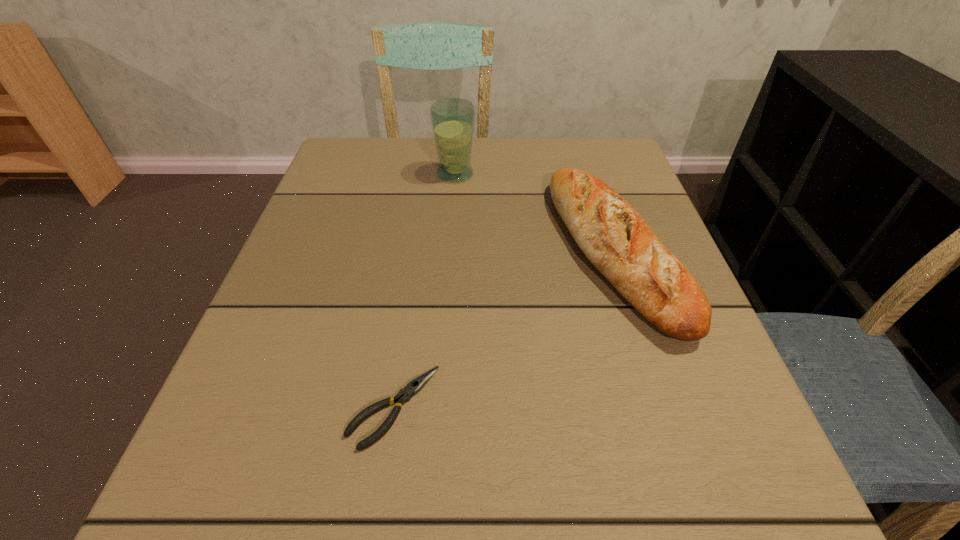
Identify the location of the tallest object. The height and width of the screenshot is (540, 960). (452, 119).

Locate an element on the screen. The height and width of the screenshot is (540, 960). baguet is located at coordinates (613, 236).

Where is `the second tallest object`? The image size is (960, 540). the second tallest object is located at coordinates (613, 236).

Locate an element on the screen. the nearest object is located at coordinates [x=413, y=387].

At what (x,y) coordinates should I click in order to perform the action: click on pliers. Please return your answer as a coordinate pair (x, y). Looking at the image, I should click on (413, 387).

At what (x,y) coordinates should I click in order to perform the action: click on blank area located 0.060m on the right of the glass. Please return your answer as a coordinate pair (x, y). This screenshot has height=540, width=960. Looking at the image, I should click on (501, 174).

Identify the location of blank area located on the back of the baguet. This screenshot has width=960, height=540. (586, 162).

Identify the location of free space located 0.400m on the back of the shortest object. (424, 207).

Where is `glass positioned at the far edge`? Image resolution: width=960 pixels, height=540 pixels. glass positioned at the far edge is located at coordinates (452, 119).

This screenshot has height=540, width=960. What are the coordinates of `baguet located in the far edge section of the desktop` in the screenshot? It's located at (613, 236).